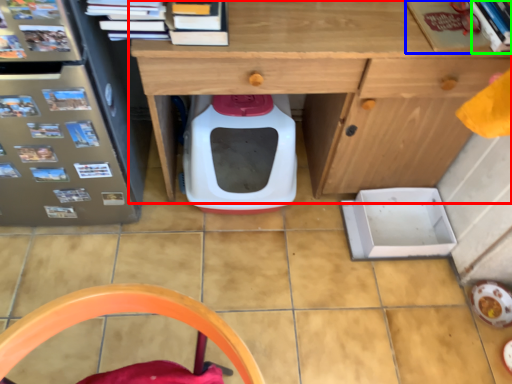
Question: Which object is the closest to the desk (highlighted by a red box)? Choose among these: book (highlighted by a blue box) or book (highlighted by a green box).

Choices:
 (A) book
 (B) book

Answer: (A)